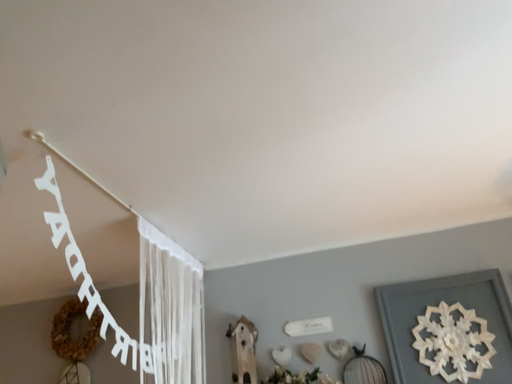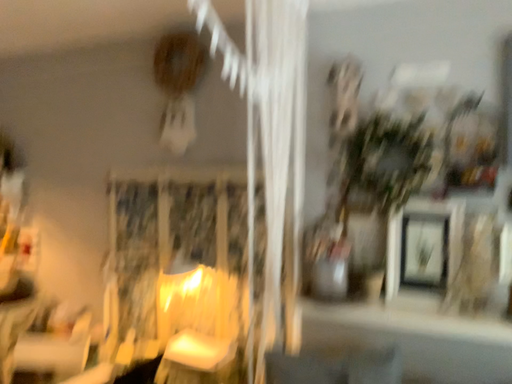
Question: Which way did the camera rotate in the video?

Choices:
 (A) rotated left
 (B) rotated right

Answer: (A)